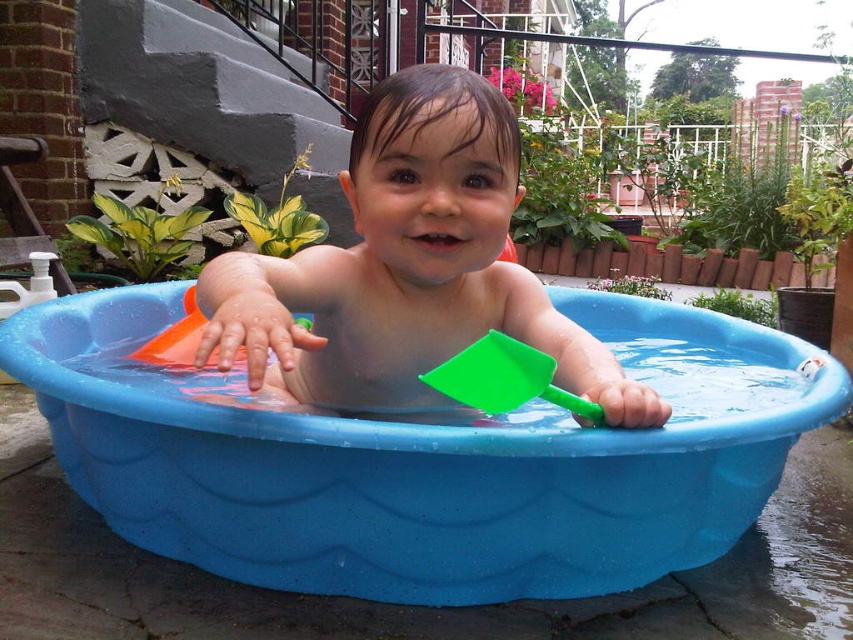
Does blue plastic bath at center appear over smooth plastic toddler at center?

Actually, blue plastic bath at center is below smooth plastic toddler at center.

Who is taller, blue plastic bath at center or smooth plastic toddler at center?

With more height is smooth plastic toddler at center.

Describe the element at coordinates (419, 465) in the screenshot. I see `blue plastic bath at center` at that location.

What are the coordinates of `blue plastic bath at center` in the screenshot? It's located at (419, 465).

Does blue plastic bath at center appear over green plastic shovel at center?

→ Incorrect, blue plastic bath at center is not positioned above green plastic shovel at center.

This screenshot has height=640, width=853. What do you see at coordinates (419, 465) in the screenshot?
I see `blue plastic bath at center` at bounding box center [419, 465].

Is point (744, 353) closer to viewer compared to point (526, 348)?

That is False.

Where is `blue plastic bath at center`? blue plastic bath at center is located at coordinates (419, 465).

Does smooth plastic toddler at center have a lesser width compared to green plastic shovel at center?

No, smooth plastic toddler at center is not thinner than green plastic shovel at center.

Does smooth plastic toddler at center appear on the left side of green plastic shovel at center?

Indeed, smooth plastic toddler at center is positioned on the left side of green plastic shovel at center.

Is point (270, 326) more distant than point (486, 403)?

No.

Where is `smooth plastic toddler at center`? This screenshot has height=640, width=853. smooth plastic toddler at center is located at coordinates (409, 268).